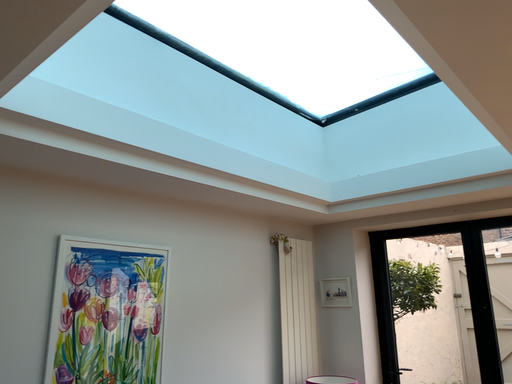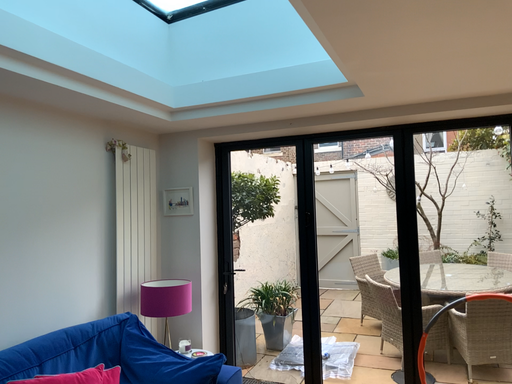
Question: Which way did the camera rotate in the video?

Choices:
 (A) rotated downward
 (B) rotated upward

Answer: (A)